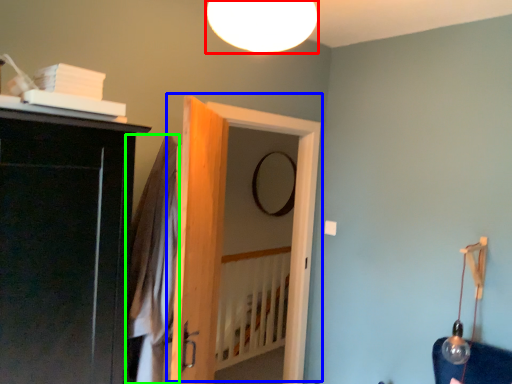
Question: Which object is positioned farthest from lamp (highlighted by a red box)? Select from door (highlighted by a blue box) and robe (highlighted by a green box).

Choices:
 (A) door
 (B) robe

Answer: (A)